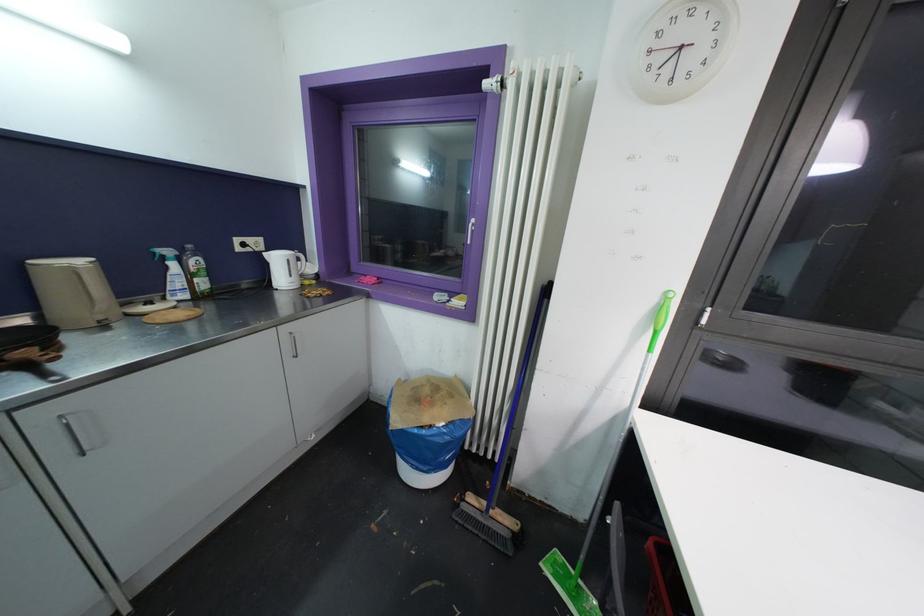
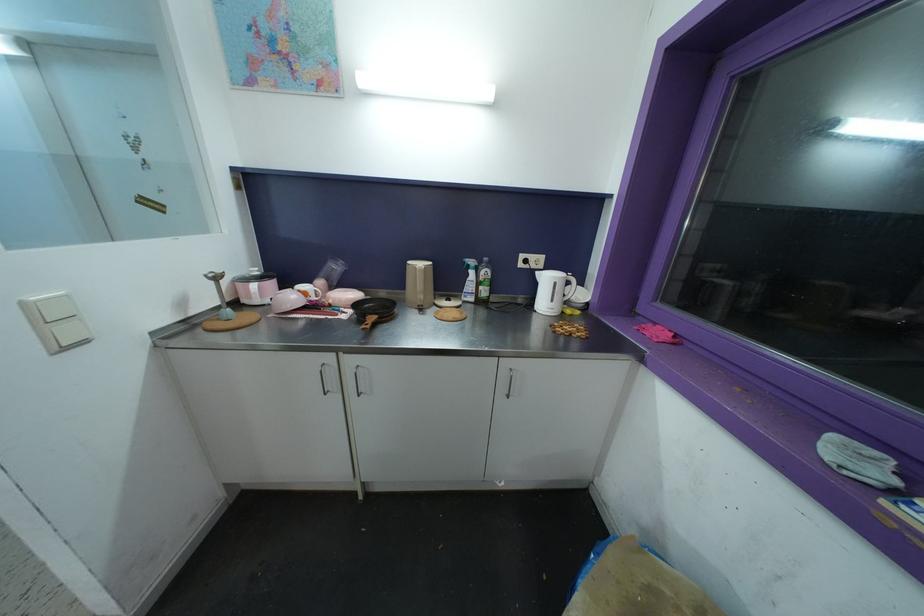
Question: How did the camera likely rotate?

Choices:
 (A) Left
 (B) Right
 (C) Up
 (D) Down

Answer: (A)